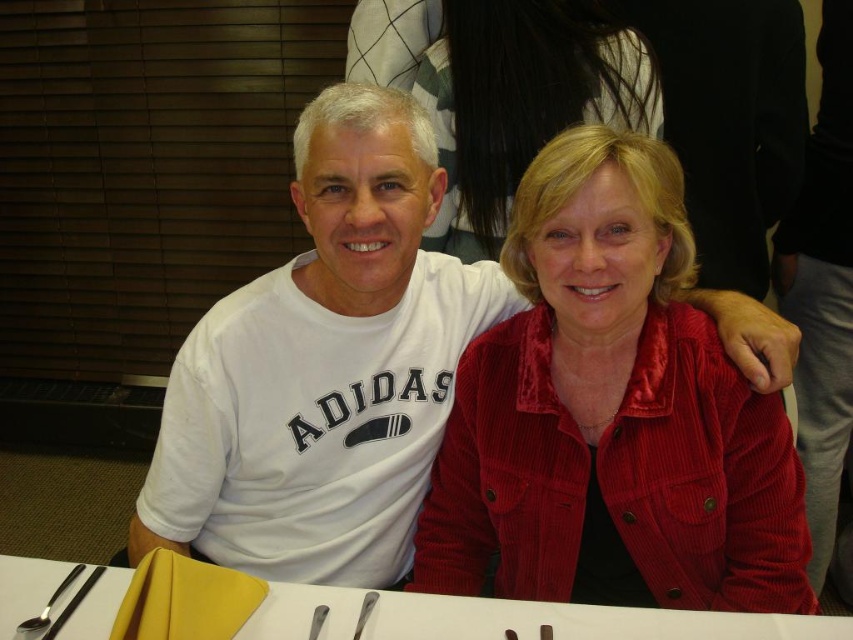
Question: Based on their relative distances, which object is nearer to the polished silver spoon at lower left?

Choices:
 (A) white cotton t-shirt at center
 (B) white plastic table at lower center
 (C) satin red jacket at center

Answer: (B)

Question: Which point is farther to the camera?

Choices:
 (A) (456, 536)
 (B) (367, 118)
 (C) (73, 582)

Answer: (A)

Question: Is satin red jacket at center bigger than white plastic table at lower center?

Choices:
 (A) no
 (B) yes

Answer: (B)

Question: Considering the relative positions of white cotton t-shirt at center and polished silver spoon at lower left in the image provided, where is white cotton t-shirt at center located with respect to polished silver spoon at lower left?

Choices:
 (A) left
 (B) right

Answer: (B)

Question: Which object is the closest to the polished silver spoon at lower left?

Choices:
 (A) satin red jacket at center
 (B) white cotton t-shirt at center
 (C) white plastic table at lower center

Answer: (C)

Question: Is white plastic table at lower center above polished silver spoon at lower left?

Choices:
 (A) no
 (B) yes

Answer: (A)